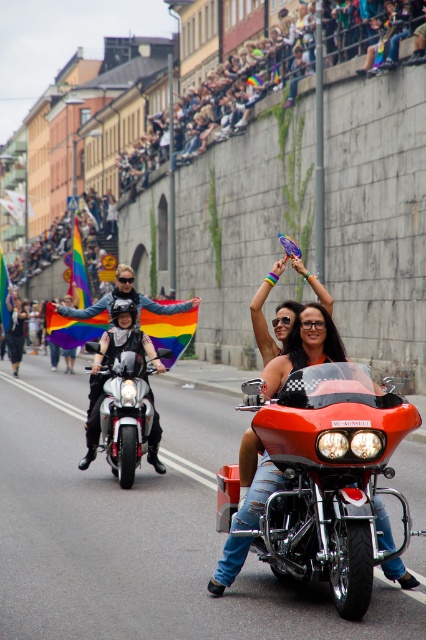
You are a photographer standing at the edge of the street during the pride parade. You want to capture a photo of both the shiny red motorcycle at center and the shiny silver motorcycle at center in the same frame. However, you notice that one of the motorcycles is taller than the other. Which motorcycle would be more likely to block the view of the rainbow flag and purple fan held by the passenger on the other motorcycle?

The shiny red motorcycle at center is much taller than the shiny silver motorcycle at center, so it would more likely block the view of the rainbow flag and purple fan held by the passenger on the shiny silver motorcycle at center.

You are a photographer positioned on the sidewalk. You want to capture a photo of both the shiny red motorcycle at center and the shiny silver motorcycle at center in the same frame. Given that your camera has a fixed focal length and limited field of view, which motorcycle should you position closer to the center of the frame to ensure both fit without cropping?

You should position the shiny red motorcycle at center closer to the center of the frame because it is wider than the shiny silver motorcycle at center. This will help ensure both motorcycles fit within the camera frame without cropping.

You are a photographer standing at the back of the street. You want to take a photo of both the shiny red motorcycle at center and the shiny silver motorcycle at center. Which motorcycle should you focus on first to ensure both are in the frame?

The shiny red motorcycle at center is located below the shiny silver motorcycle at center, so you should focus on the shiny silver motorcycle at center first to ensure both are in the frame.